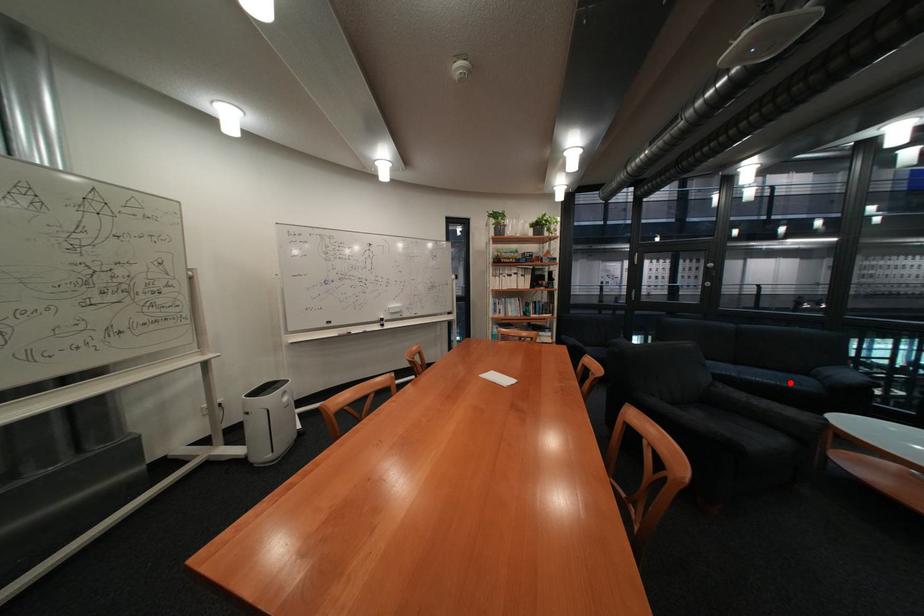
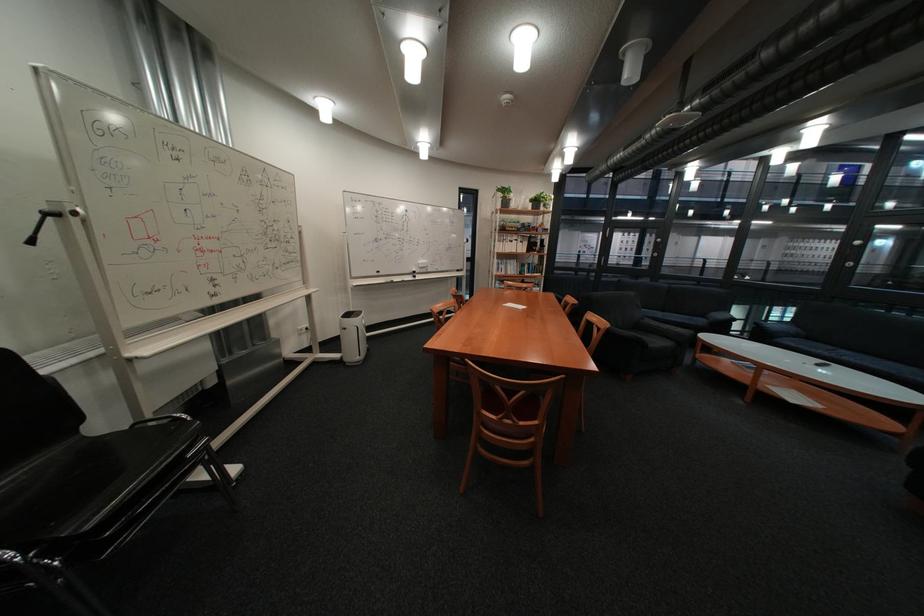
In the second image, find the point that corresponds to the highlighted location in the first image.

(698, 321)